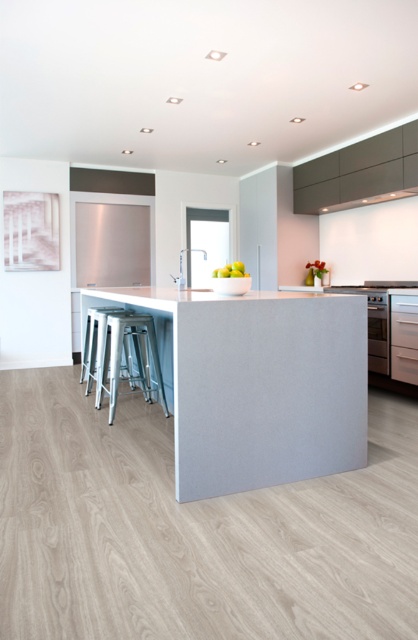
Question: Which object is farther from the camera taking this photo?

Choices:
 (A) matte gray countertop at center
 (B) metallic silver bar stool at lower left

Answer: (B)

Question: From the image, what is the correct spatial relationship of satin silver oven at center-right in relation to satin silver metallic exhaust hood at upper right?

Choices:
 (A) above
 (B) below

Answer: (B)

Question: Is matte gray countertop at center positioned behind satin silver oven at center-right?

Choices:
 (A) no
 (B) yes

Answer: (A)

Question: Among these objects, which one is nearest to the camera?

Choices:
 (A) metallic silver bar stool at lower left
 (B) satin silver metallic exhaust hood at upper right
 (C) matte gray countertop at center

Answer: (C)

Question: In this image, where is matte gray countertop at center located relative to metallic silver bar stool at lower left?

Choices:
 (A) right
 (B) left

Answer: (A)

Question: Estimate the real-world distances between objects in this image. Which object is closer to the satin silver metallic exhaust hood at upper right?

Choices:
 (A) metallic silver bar stool at lower left
 (B) matte gray countertop at center

Answer: (B)